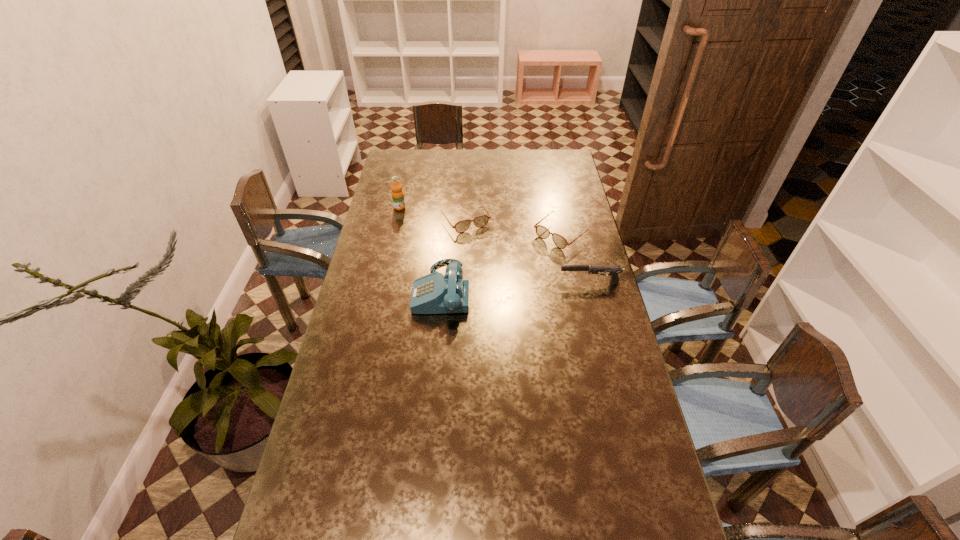
At what (x,y) coordinates should I click in order to perform the action: click on telephone. Please return your answer as a coordinate pair (x, y). Looking at the image, I should click on (435, 293).

In order to click on the third tallest object in this screenshot , I will do `click(614, 270)`.

The height and width of the screenshot is (540, 960). Identify the location of the left sunglasses. (480, 221).

Find the location of a particular element. The width and height of the screenshot is (960, 540). the leftmost object is located at coordinates (397, 193).

The image size is (960, 540). In order to click on orange juice in this screenshot , I will do `click(397, 193)`.

Locate an element on the screen. the right sunglasses is located at coordinates (542, 232).

Locate an element on the screen. Image resolution: width=960 pixels, height=540 pixels. vacant space located on the dial of the second tallest object is located at coordinates (383, 289).

Find the location of a particular element. The height and width of the screenshot is (540, 960). vacant space situated 0.170m on the dial of the second tallest object is located at coordinates (367, 289).

At what (x,y) coordinates should I click in order to perform the action: click on vacant space located 0.180m on the dial of the second tallest object. Please return your answer as a coordinate pair (x, y). Looking at the image, I should click on (364, 289).

Find the location of `free spot located at the muzzle end of the third shortest object`. free spot located at the muzzle end of the third shortest object is located at coordinates (508, 282).